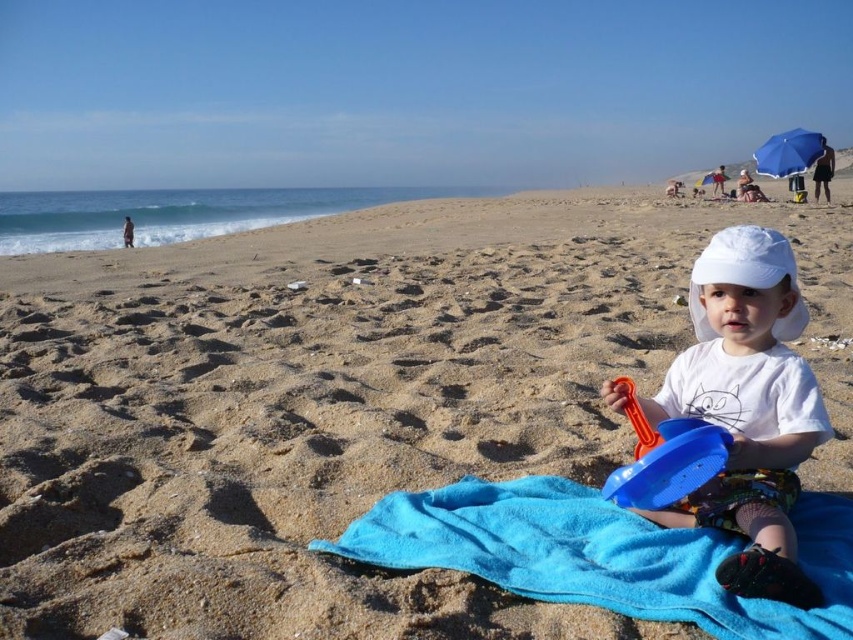
Is point (358, 250) behind point (706, 467)?

That is True.

Does point (157, 324) lie behind point (643, 456)?

Yes, it is behind point (643, 456).

Locate an element on the screen. Image resolution: width=853 pixels, height=640 pixels. blue fabric towel at center is located at coordinates (345, 403).

Does white cotton shirt at lower right lie behind blue plastic bucket at lower right?

No, it is not.

Is point (741, 385) more distant than point (680, 454)?

Yes, point (741, 385) is behind point (680, 454).

Who is more distant from viewer, (764, 577) or (631, 474)?

Positioned behind is point (631, 474).

Identify the location of white cotton shirt at lower right. The image size is (853, 640). (747, 406).

Does blue fabric towel at center have a lesser height compared to white matte baseball hat at center?

No, blue fabric towel at center is not shorter than white matte baseball hat at center.

Can you confirm if blue fabric towel at center is thinner than white matte baseball hat at center?

No.

Does point (840, 376) lie behind point (792, 275)?

Yes, it is behind point (792, 275).

Where is `blue fabric towel at center`? Image resolution: width=853 pixels, height=640 pixels. blue fabric towel at center is located at coordinates (345, 403).